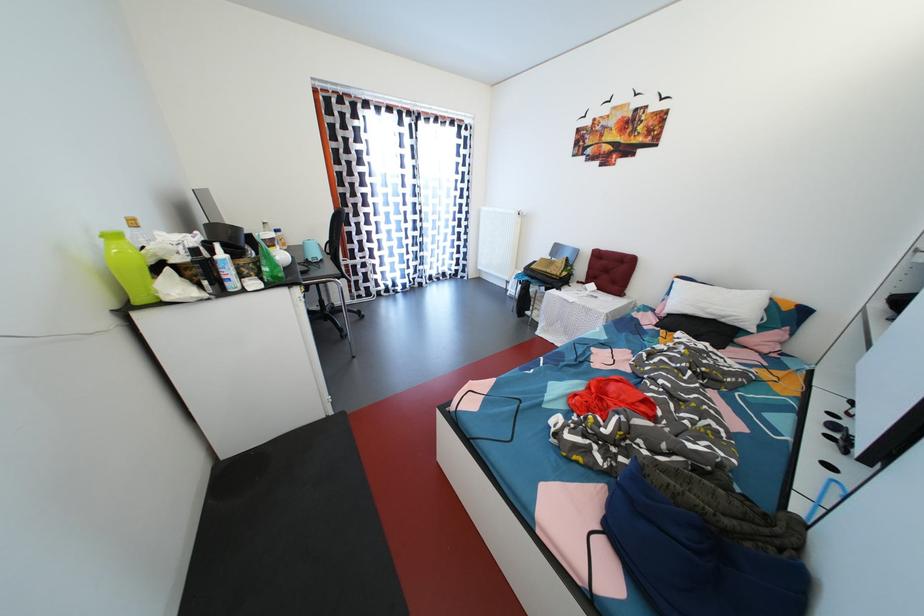
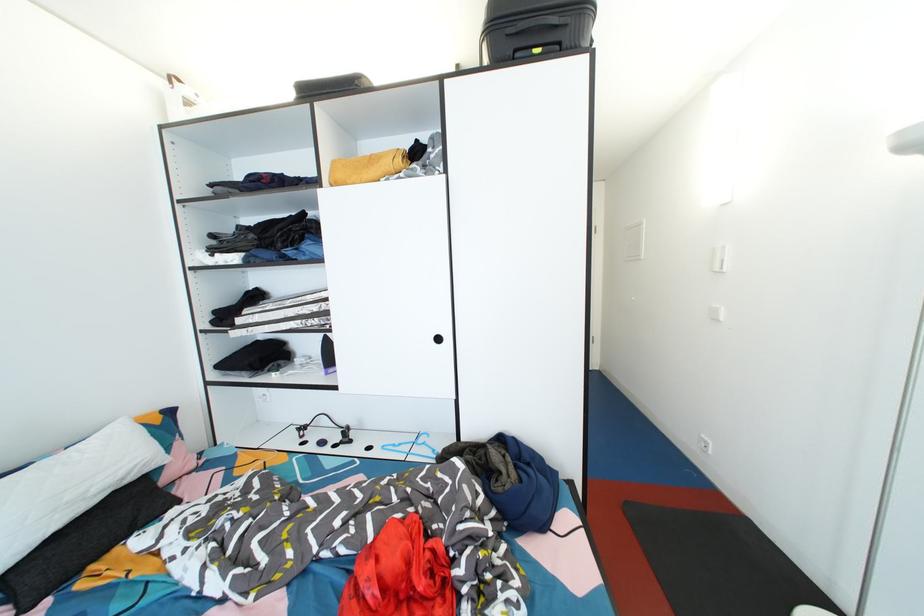
The point at [675,321] is marked in the first image. Where is the corresponding point in the second image?

(8, 583)